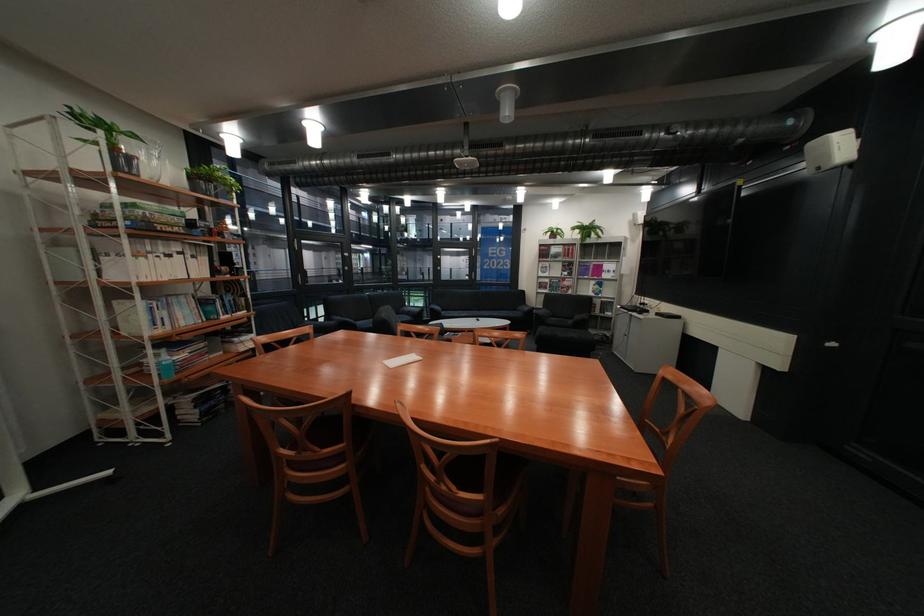
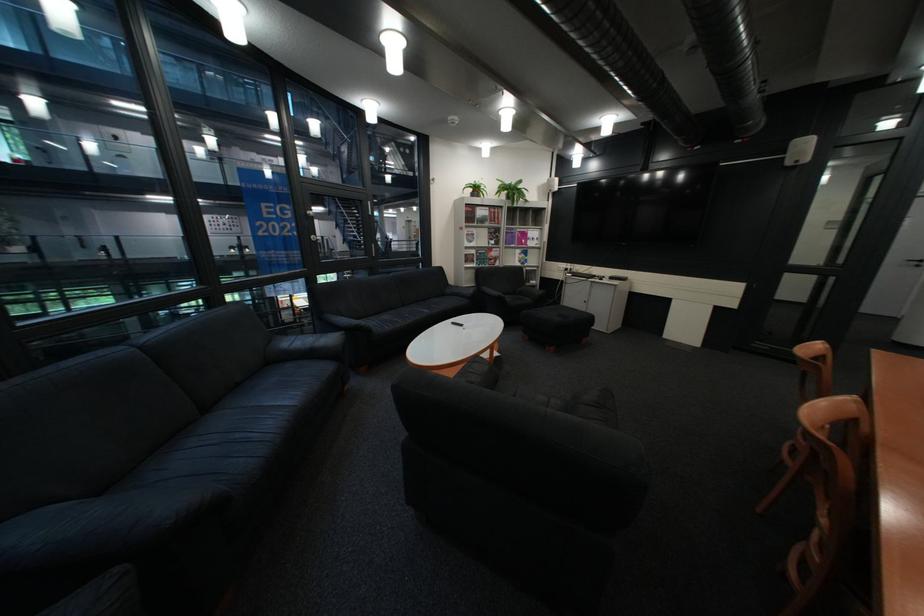
Find the pixel in the second image that matches (578,265) in the first image.

(505, 233)